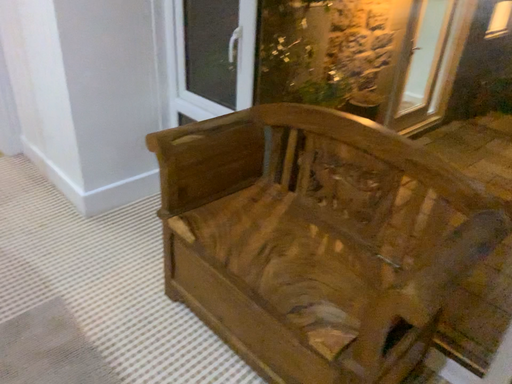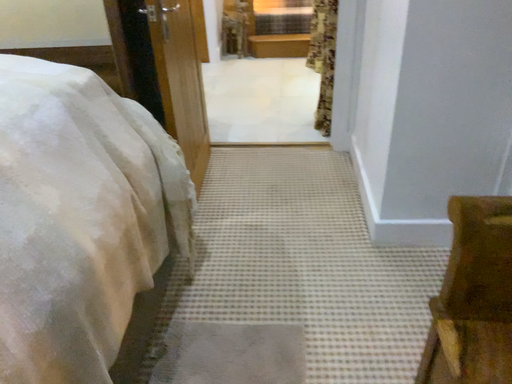
Question: How did the camera likely rotate when shooting the video?

Choices:
 (A) rotated downward
 (B) rotated upward

Answer: (B)